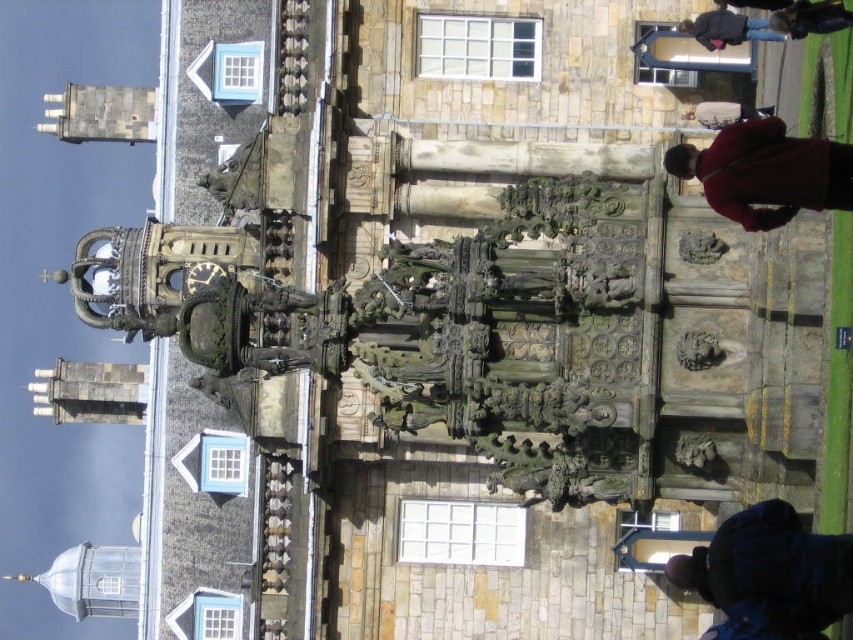
Between dark brown leather jacket at upper right and matte brown coat at upper right, which one appears on the right side from the viewer's perspective?

Positioned to the right is matte brown coat at upper right.

Does dark brown leather jacket at upper right have a greater width compared to matte brown coat at upper right?

Yes.

I want to click on dark brown leather jacket at upper right, so click(x=811, y=17).

Identify the location of dark brown leather jacket at upper right. (811, 17).

Can you confirm if red woolen sweater at upper right is bigger than dark blue jacket at upper right?

Incorrect, red woolen sweater at upper right is not larger than dark blue jacket at upper right.

The image size is (853, 640). Describe the element at coordinates (766, 172) in the screenshot. I see `red woolen sweater at upper right` at that location.

Measure the distance between point (787, 150) and camera.

Point (787, 150) and camera are 42.27 meters apart from each other.

Locate an element on the screen. The height and width of the screenshot is (640, 853). red woolen sweater at upper right is located at coordinates (766, 172).

Between dark blue jacket at lower right and dark blue jacket at upper right, which one is positioned higher?

dark blue jacket at upper right is higher up.

Who is lower down, dark blue jacket at lower right or dark blue jacket at upper right?

dark blue jacket at lower right

Between point (843, 560) and point (727, 33), which one is positioned behind?

The point (727, 33) is more distant.

Find the location of a particular element. The height and width of the screenshot is (640, 853). dark blue jacket at lower right is located at coordinates (769, 573).